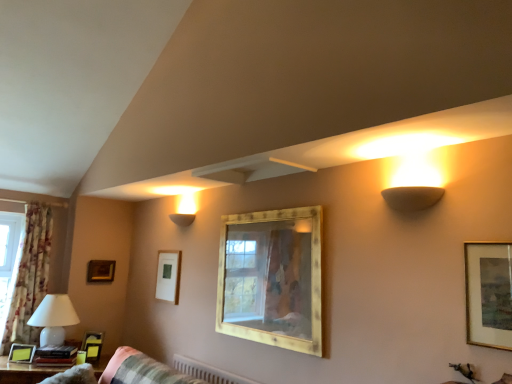
What is the approximate width of wooden mirror at center, acting as the 5th picture frame starting from the back?

It is 2.13 inches.

The width and height of the screenshot is (512, 384). What do you see at coordinates (25, 372) in the screenshot? I see `wooden table at lower left` at bounding box center [25, 372].

Describe the element at coordinates (168, 276) in the screenshot. I see `matte white picture frame at center-left, which appears as the third picture frame when viewed from the right` at that location.

Measure the distance between matte black picture frame at lower left, the 4th picture frame in the front-to-back sequence, and camera.

The distance of matte black picture frame at lower left, the 4th picture frame in the front-to-back sequence, from camera is 10.74 feet.

The image size is (512, 384). What do you see at coordinates (21, 353) in the screenshot?
I see `matte yellow picture frame at lower left, positioned as the fourth picture frame in back-to-front order` at bounding box center [21, 353].

How much space does matte white sconce at upper center, which appears as the second lamp when viewed from the right, occupy horizontally?

It is 14.04 centimeters.

Where is `wooden mirror at center, the 5th picture frame from the left`? wooden mirror at center, the 5th picture frame from the left is located at coordinates (272, 278).

From a real-world perspective, who is located lower, floral fabric curtain at left or gold-framed picture at right, placed as the 6th picture frame when sorted from left to right?

floral fabric curtain at left, from a real-world perspective.

How far apart are floral fabric curtain at left and gold-framed picture at right, placed as the 6th picture frame when sorted from left to right?

floral fabric curtain at left and gold-framed picture at right, placed as the 6th picture frame when sorted from left to right, are 3.29 meters apart from each other.

Is point (14, 339) positioned before point (482, 311)?

No.

Between floral fabric curtain at left and gold-framed picture at right, which appears as the 1th picture frame when viewed from the right, which one appears on the left side from the viewer's perspective?

From the viewer's perspective, floral fabric curtain at left appears more on the left side.

This screenshot has height=384, width=512. In order to click on picture frame that is the 5th one when counting rightward from the floral fabric curtain at left in this screenshot , I will do `click(272, 278)`.

From the picture: In terms of height, does wooden mirror at center, the second picture frame from the right, look taller or shorter compared to floral fabric curtain at left?

Considering their sizes, wooden mirror at center, the second picture frame from the right, has less height than floral fabric curtain at left.

Is matte beige wall sconce at upper right, which is the 2th lamp from left to right, not inside matte black picture frame at lower left, the 4th picture frame in the front-to-back sequence?

Absolutely, matte beige wall sconce at upper right, which is the 2th lamp from left to right, is external to matte black picture frame at lower left, the 4th picture frame in the front-to-back sequence.

Considering their positions, is matte beige wall sconce at upper right, which is the 2th lamp from left to right, located in front of or behind matte black picture frame at lower left, the 3th picture frame positioned from the back?

matte beige wall sconce at upper right, which is the 2th lamp from left to right, is positioned closer to the viewer than matte black picture frame at lower left, the 3th picture frame positioned from the back.

Which point is more distant from viewer, [440,193] or [100,344]?

The point [100,344] is more distant.

Is matte beige wall sconce at upper right, which is the 2th lamp in back-to-front order, not near matte black picture frame at lower left, which is the third picture frame from left to right?

matte beige wall sconce at upper right, which is the 2th lamp in back-to-front order, is positioned a significant distance from matte black picture frame at lower left, which is the third picture frame from left to right.

Is point (172, 219) positioned in front of point (35, 271)?

Yes, it is.

Consider the image. From a real-world perspective, between matte white sconce at upper center, the 1th lamp viewed from the left, and floral fabric curtain at left, who is vertically lower?

floral fabric curtain at left is physically lower.

Based on the photo, does matte white sconce at upper center, the 1th lamp viewed from the left, have a greater height compared to floral fabric curtain at left?

Incorrect, the height of matte white sconce at upper center, the 1th lamp viewed from the left, is not larger of that of floral fabric curtain at left.

Find the location of `the 2nd lamp positioned above the floral fabric curtain at left (from a real-world perspective)`. the 2nd lamp positioned above the floral fabric curtain at left (from a real-world perspective) is located at coordinates (182, 219).

In terms of size, does wooden table at lower left appear bigger or smaller than gold-framed picture at right, placed as the 6th picture frame when sorted from left to right?

wooden table at lower left is bigger than gold-framed picture at right, placed as the 6th picture frame when sorted from left to right.

In the image, is wooden table at lower left on the left side or the right side of gold-framed picture at right, which is counted as the 1th picture frame, starting from the front?

In the image, wooden table at lower left appears on the left side of gold-framed picture at right, which is counted as the 1th picture frame, starting from the front.

How different are the orientations of wooden table at lower left and gold-framed picture at right, placed as the 6th picture frame when sorted from left to right, in degrees?

They differ by 57.7 degrees in their facing directions.

How many degrees apart are the facing directions of matte white picture frame at center-left, acting as the 5th picture frame starting from the front, and wooden frame at upper left, the 1th picture frame in the back-to-front sequence?

The facing directions of matte white picture frame at center-left, acting as the 5th picture frame starting from the front, and wooden frame at upper left, the 1th picture frame in the back-to-front sequence, are 95.2 degrees apart.

Would you say matte white picture frame at center-left, acting as the 2th picture frame starting from the back, is a long distance from wooden frame at upper left, which is the second picture frame from left to right?

No.

Which of these two, matte white picture frame at center-left, which appears as the third picture frame when viewed from the right, or wooden frame at upper left, which is the second picture frame from left to right, is wider?

With larger width is wooden frame at upper left, which is the second picture frame from left to right.

From a real-world perspective, is white matte table lamp at lower left beneath matte black picture frame at lower left, the 3th picture frame positioned from the back?

Incorrect, from a real-world perspective, white matte table lamp at lower left is higher than matte black picture frame at lower left, the 3th picture frame positioned from the back.

Is white matte table lamp at lower left located outside matte black picture frame at lower left, the 3th picture frame positioned from the back?

Yes, white matte table lamp at lower left is not within matte black picture frame at lower left, the 3th picture frame positioned from the back.

Could you tell me if white matte table lamp at lower left is facing matte black picture frame at lower left, which is the third picture frame from left to right?

No, white matte table lamp at lower left does not turn towards matte black picture frame at lower left, which is the third picture frame from left to right.

How far apart are white matte table lamp at lower left and matte black picture frame at lower left, the 3th picture frame positioned from the back?

white matte table lamp at lower left and matte black picture frame at lower left, the 3th picture frame positioned from the back, are 11.01 inches apart from each other.

Locate an element on the screen. Image resolution: width=512 pixels, height=384 pixels. picture frame that is the 3rd one above the floral fabric curtain at left (from a real-world perspective) is located at coordinates (488, 294).

What are the coordinates of `picture frame that is the 5th object to the right of the floral fabric curtain at left, starting at the anchor` in the screenshot? It's located at (272, 278).

Estimate the real-world distances between objects in this image. Which object is closer to matte white sconce at upper center, the 1th lamp viewed from the left, gold-framed picture at right, placed as the 6th picture frame when sorted from left to right, or matte beige wall sconce at upper right, which is the 2th lamp from left to right?

matte beige wall sconce at upper right, which is the 2th lamp from left to right, is positioned closer to the anchor matte white sconce at upper center, the 1th lamp viewed from the left.

Looking at the image, which one is located further to matte white picture frame at center-left, acting as the 2th picture frame starting from the back, wooden table at lower left or matte white sconce at upper center, which is counted as the first lamp, starting from the bottom?

Based on the image, wooden table at lower left appears to be further to matte white picture frame at center-left, acting as the 2th picture frame starting from the back.

Looking at the image, which one is located closer to wooden frame at upper left, which is the second picture frame from left to right, matte white sconce at upper center, the 1th lamp viewed from the left, or matte yellow picture frame at lower left, marked as the sixth picture frame in a right-to-left arrangement?

matte yellow picture frame at lower left, marked as the sixth picture frame in a right-to-left arrangement, lies closer to wooden frame at upper left, which is the second picture frame from left to right, than the other object.

Considering their positions, is matte black picture frame at lower left, the 3th picture frame positioned from the back, positioned closer to matte white picture frame at center-left, which appears as the third picture frame when viewed from the right, than white matte table lamp at lower left?

Among the two, matte black picture frame at lower left, the 3th picture frame positioned from the back, is located nearer to matte white picture frame at center-left, which appears as the third picture frame when viewed from the right.

Looking at the image, which one is located closer to matte yellow picture frame at lower left, the first picture frame viewed from the left, wooden mirror at center, the 5th picture frame from the left, or matte white picture frame at center-left, acting as the 5th picture frame starting from the front?

matte white picture frame at center-left, acting as the 5th picture frame starting from the front, is positioned closer to the anchor matte yellow picture frame at lower left, the first picture frame viewed from the left.

In the scene shown: Based on their spatial positions, is wooden mirror at center, the second picture frame from the right, or matte yellow picture frame at lower left, the first picture frame viewed from the left, closer to matte beige wall sconce at upper right, the first lamp in the front-to-back sequence?

wooden mirror at center, the second picture frame from the right.

Estimate the real-world distances between objects in this image. Which object is closer to matte yellow picture frame at lower left, the first picture frame viewed from the left, gold-framed picture at right, placed as the 6th picture frame when sorted from left to right, or matte white sconce at upper center, the second lamp in the top-to-bottom sequence?

matte white sconce at upper center, the second lamp in the top-to-bottom sequence, is positioned closer to the anchor matte yellow picture frame at lower left, the first picture frame viewed from the left.

Estimate the real-world distances between objects in this image. Which object is closer to white matte table lamp at lower left, matte black picture frame at lower left, which is the third picture frame from left to right, or gold-framed picture at right, positioned as the 6th picture frame in back-to-front order?

matte black picture frame at lower left, which is the third picture frame from left to right, lies closer to white matte table lamp at lower left than the other object.

This screenshot has width=512, height=384. Identify the location of picture frame positioned between wooden table at lower left and white matte table lamp at lower left from near to far. (21, 353).

This screenshot has height=384, width=512. I want to click on table lamp between matte yellow picture frame at lower left, positioned as the fourth picture frame in back-to-front order, and wooden mirror at center, the second picture frame from the right, from left to right, so click(54, 318).

What are the coordinates of `table between white matte table lamp at lower left and matte beige wall sconce at upper right, the first lamp in the front-to-back sequence` in the screenshot? It's located at (25, 372).

The width and height of the screenshot is (512, 384). I want to click on lamp situated between matte yellow picture frame at lower left, the first picture frame viewed from the left, and matte beige wall sconce at upper right, the 1th lamp positioned from the top, from left to right, so click(x=182, y=219).